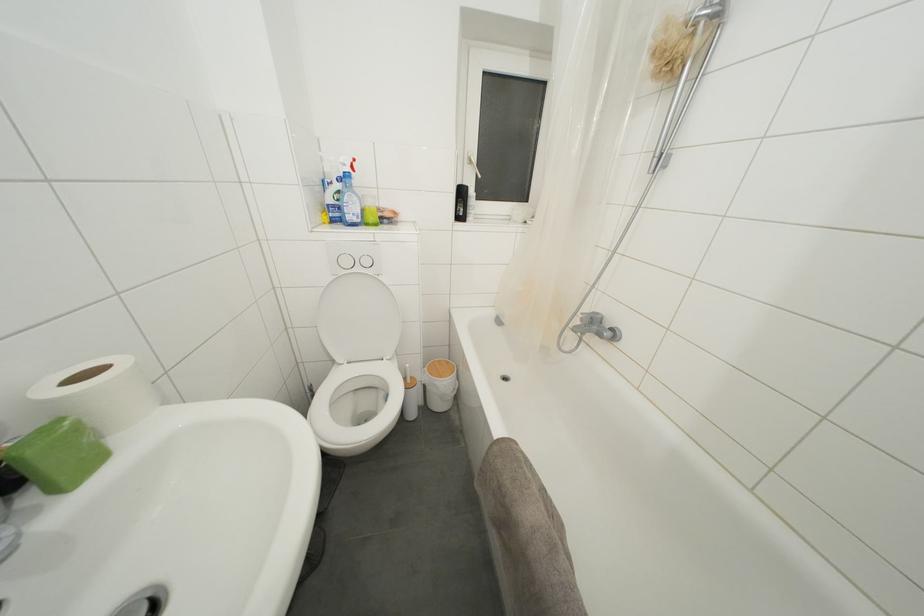
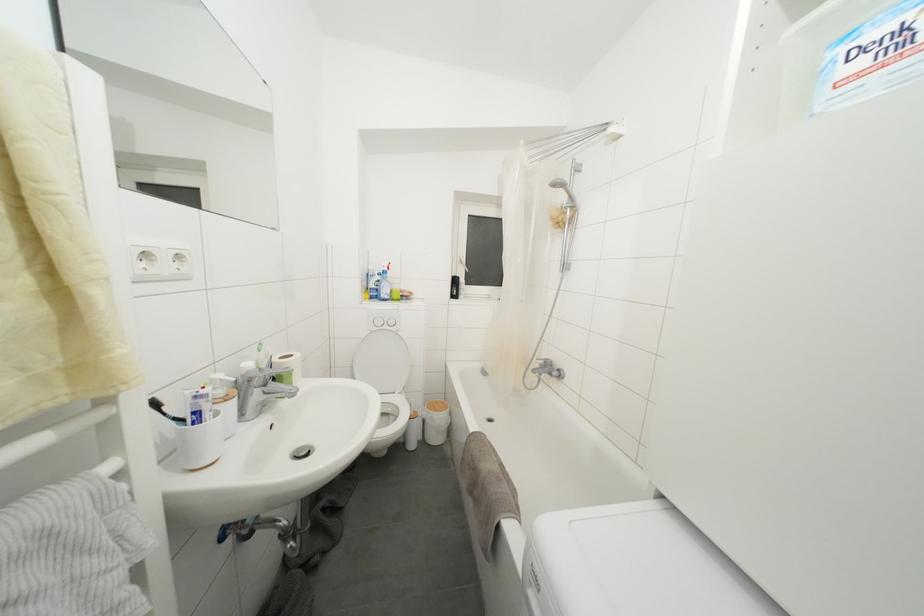
Question: The images are taken continuously from a first-person perspective. In which direction is your viewpoint rotating?

Choices:
 (A) Left
 (B) Right
 (C) Up
 (D) Down

Answer: (C)